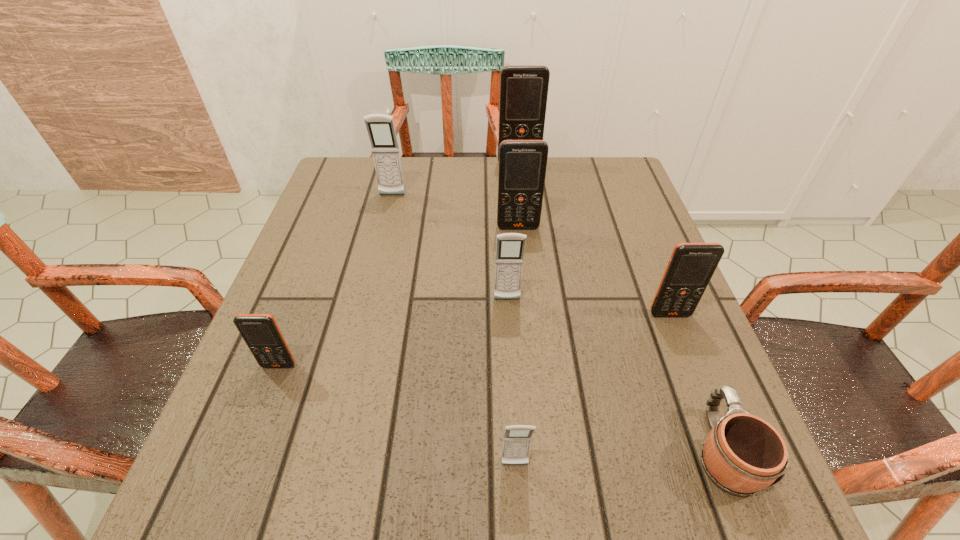
The image size is (960, 540). I want to click on the third nearest object, so click(x=261, y=333).

You are a GUI agent. You are given a task and a screenshot of the screen. Output one action in this format:
    pyautogui.click(x=<x>, y=<y>)
    Task: Click on the leftmost orange cellular telephone
    The height and width of the screenshot is (540, 960).
    Given the screenshot: What is the action you would take?
    pyautogui.click(x=261, y=333)

Find the location of a particular element. The height and width of the screenshot is (540, 960). the nearest gray cellular telephone is located at coordinates (517, 439).

Image resolution: width=960 pixels, height=540 pixels. Find the location of `the smallest gray cellular telephone`. the smallest gray cellular telephone is located at coordinates (517, 439).

Find the location of a particular element. This screenshot has height=540, width=960. the shortest object is located at coordinates (743, 454).

This screenshot has height=540, width=960. Find the location of `vacant space located 0.320m on the screen of the tallest object`. vacant space located 0.320m on the screen of the tallest object is located at coordinates (528, 240).

What are the coordinates of `free space located on the front-facing side of the leftmost gray cellular telephone` in the screenshot? It's located at (384, 228).

Locate an element on the screen. Image resolution: width=960 pixels, height=540 pixels. free spot located on the screen of the fifth nearest cellular telephone is located at coordinates (528, 332).

In order to click on free space located on the front-facing side of the second biggest gray cellular telephone in this screenshot , I will do `click(517, 472)`.

The width and height of the screenshot is (960, 540). Identify the location of free space located on the screen of the rightmost orange cellular telephone. (689, 362).